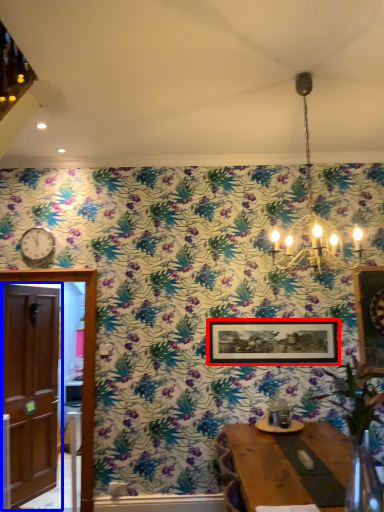
Question: Among these objects, which one is nearest to the camera, picture frame (highlighted by a red box) or door (highlighted by a blue box)?

Choices:
 (A) picture frame
 (B) door

Answer: (B)